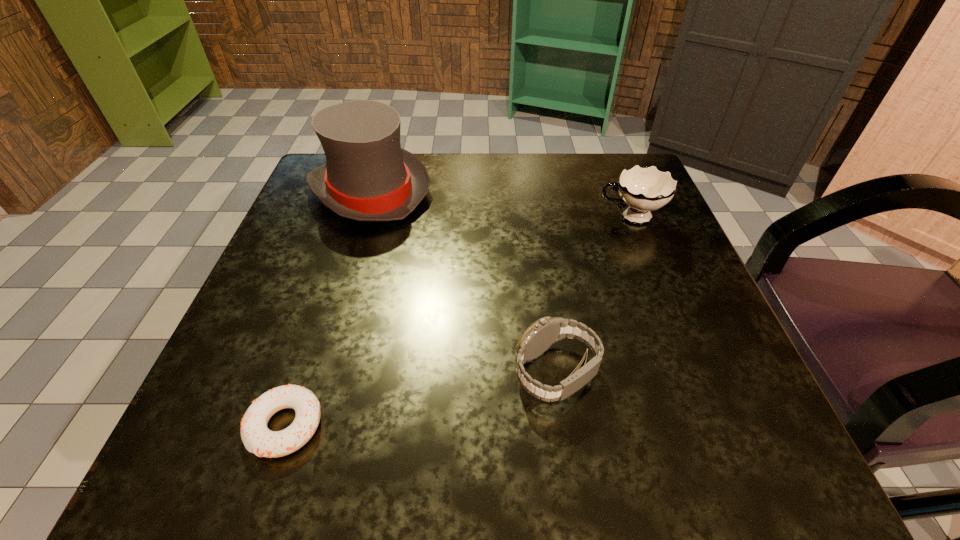
The image size is (960, 540). What are the coordinates of `empty space that is in between the third object from left to right and the doughnut` in the screenshot? It's located at (420, 399).

I want to click on free spot between the shortest object and the cup, so click(x=458, y=321).

Find the location of `vacant space that is in between the watch and the shortest object`. vacant space that is in between the watch and the shortest object is located at coordinates (420, 399).

Locate an element on the screen. The width and height of the screenshot is (960, 540). empty space between the cup and the watch is located at coordinates (593, 295).

Find the location of a particular element. This screenshot has width=960, height=540. vacant area that lies between the rightmost object and the watch is located at coordinates (593, 295).

This screenshot has height=540, width=960. In order to click on empty space between the rightmost object and the tallest object in this screenshot , I will do `click(500, 204)`.

You are a GUI agent. You are given a task and a screenshot of the screen. Output one action in this format:
    pyautogui.click(x=<x>, y=<y>)
    Task: Click on the empty space between the cup and the tallest object
    
    Given the screenshot: What is the action you would take?
    pyautogui.click(x=500, y=204)

Locate an element on the screen. free space between the doughnut and the rightmost object is located at coordinates (458, 321).

At what (x,y) coordinates should I click in order to perform the action: click on object that is the closest to the shortest object. Please return your answer as a coordinate pair (x, y). Image resolution: width=960 pixels, height=540 pixels. Looking at the image, I should click on (545, 332).

Identify which object is located as the second nearest to the third object from left to right. Please provide its 2D coordinates. Your answer should be formatted as a tuple, i.e. [(x, y)], where the tuple contains the x and y coordinates of a point satisfying the conditions above.

[(644, 189)]